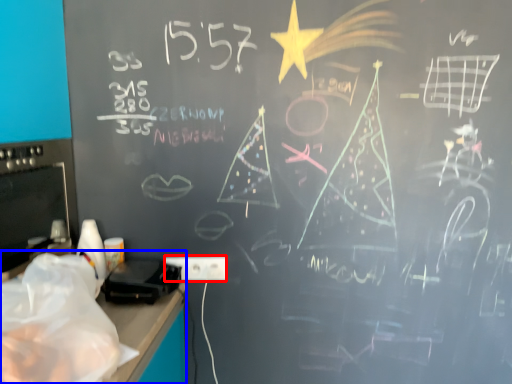
Question: Which object appears farthest to the camera in this image, electric outlet (highlighted by a red box) or computer desk (highlighted by a blue box)?

Choices:
 (A) electric outlet
 (B) computer desk

Answer: (A)